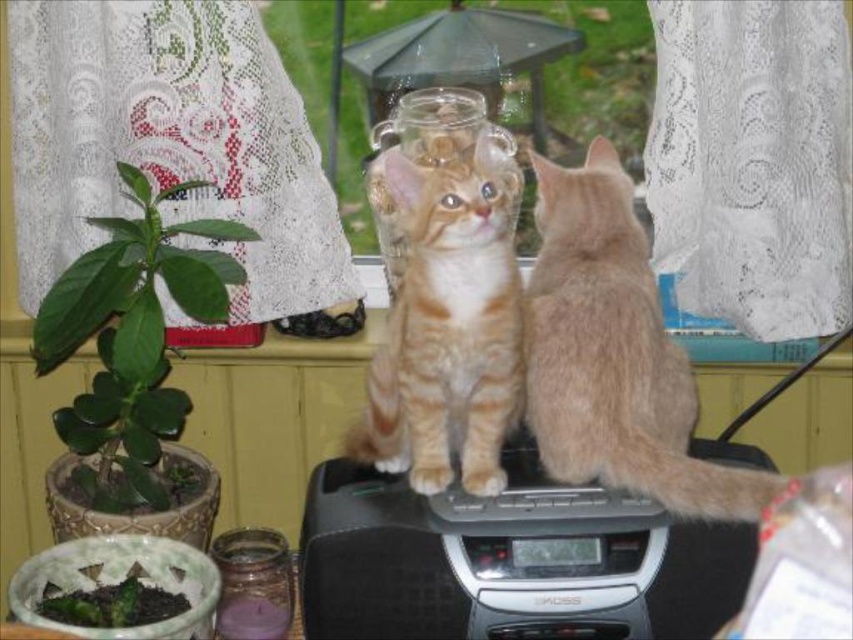
Which is in front, point (367, 561) or point (346, 122)?

Positioned in front is point (367, 561).

Between black plastic radio at center and green leafy plant at center, which one has more height?

green leafy plant at center is taller.

Is point (668, 627) less distant than point (601, 19)?

Yes, point (668, 627) is closer to viewer.

This screenshot has height=640, width=853. What are the coordinates of `black plastic radio at center` in the screenshot? It's located at (494, 561).

What do you see at coordinates (596, 76) in the screenshot? This screenshot has height=640, width=853. I see `green leafy plant at center` at bounding box center [596, 76].

Between green leafy plant at center and green matte plant at left, which one is positioned higher?

green leafy plant at center is higher up.

Between point (351, 160) and point (102, 499), which one is positioned behind?

The point (351, 160) is behind.

Identify the location of green leafy plant at center. Image resolution: width=853 pixels, height=640 pixels. (596, 76).

Is orange tabby cat at center smaller than transparent glass candle at center?

Actually, orange tabby cat at center might be larger than transparent glass candle at center.

This screenshot has width=853, height=640. I want to click on orange tabby cat at center, so click(x=447, y=324).